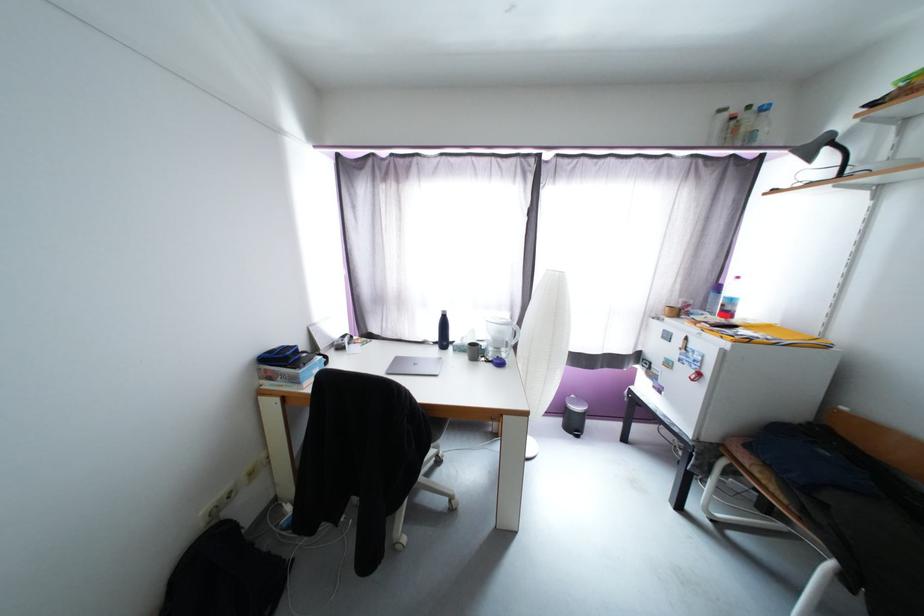
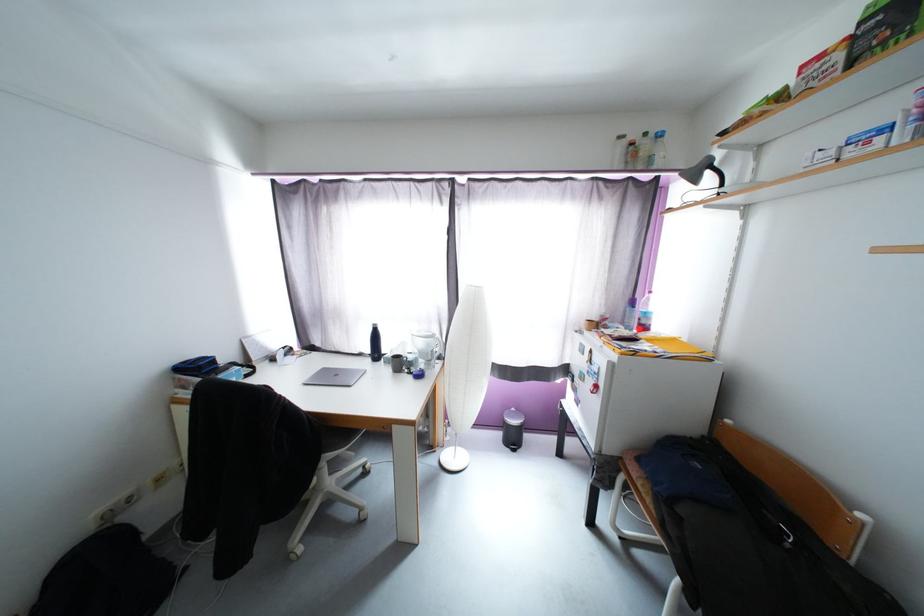
Question: I am providing you with two images of the same scene from different viewpoints. Which of the following objects are not visible in image2?

Choices:
 (A) clear plastic bottle
 (B) red top bottle
 (C) grey lamp head
 (D) none of these

Answer: (D)